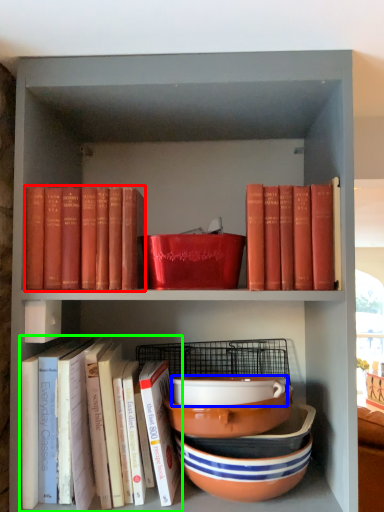
Question: Which object is positioned closest to book (highlighted by a red box)? Select from bowl (highlighted by a blue box) and book (highlighted by a green box).

Choices:
 (A) bowl
 (B) book

Answer: (B)